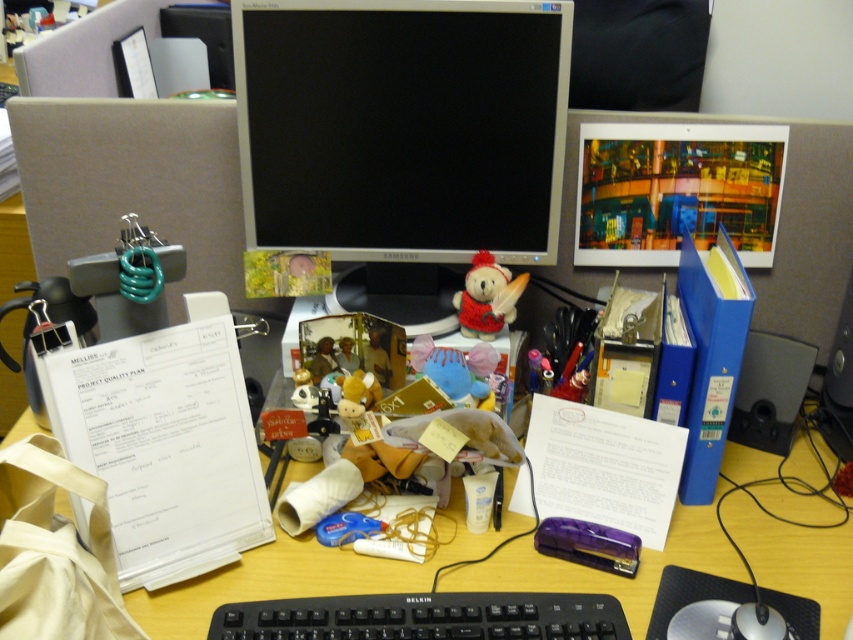
Is black glossy monitor at center wider than black plastic keyboard at center?

Yes, black glossy monitor at center is wider than black plastic keyboard at center.

How much distance is there between black glossy monitor at center and black plastic keyboard at center?

They are 54.25 centimeters apart.

Is point (527, 52) closer to camera compared to point (593, 612)?

No, it is not.

Where is `black glossy monitor at center`? black glossy monitor at center is located at coordinates (402, 128).

Is red knitted teddy bear at center bigger than fluffy yellow plush at center?

Yes.

Locate an element on the screen. This screenshot has width=853, height=640. red knitted teddy bear at center is located at coordinates (486, 298).

I want to click on red knitted teddy bear at center, so click(x=486, y=298).

Can you confirm if black glossy monitor at center is positioned above fluffy yellow plush at center?

Indeed, black glossy monitor at center is positioned over fluffy yellow plush at center.

Identify the location of black glossy monitor at center. (402, 128).

Looking at this image, who is more distant from viewer, (274,93) or (337,378)?

The point (274,93) is behind.

The width and height of the screenshot is (853, 640). In order to click on black glossy monitor at center in this screenshot , I will do `click(402, 128)`.